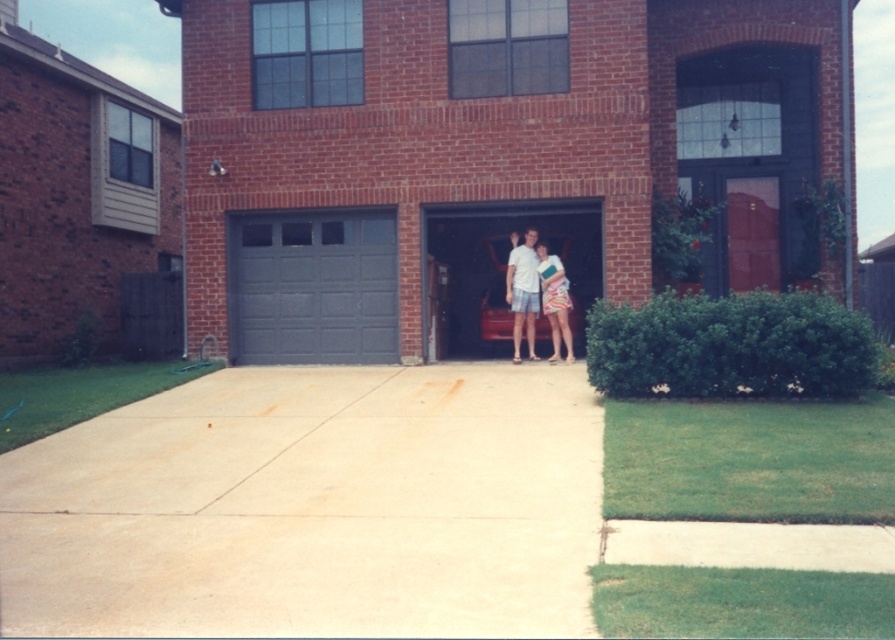
You are a painter who needs to cover the metallic gray garage door at center and the white cotton shirt at center with paint. Which object requires less paint to cover its visible surface?

The metallic gray garage door at center requires less paint because it has a smaller size compared to the white cotton shirt at center.

You are a delivery person approaching the house and need to locate the person wearing the matte white shorts at center. According to the scene, where would you find them relative to the metallic gray garage door at center?

The matte white shorts at center is behind the metallic gray garage door at center, so the person is located behind the garage door.

You are a painter who needs to place a ladder against the gray matte garage door at left. The ladder is as wide as the white cotton shirt at center. Will the ladder fit horizontally without overlapping the door edges?

The gray matte garage door at left might be wider than the white cotton shirt at center, so the ladder, which is as wide as the white cotton shirt at center, should fit horizontally without overlapping the door edges.